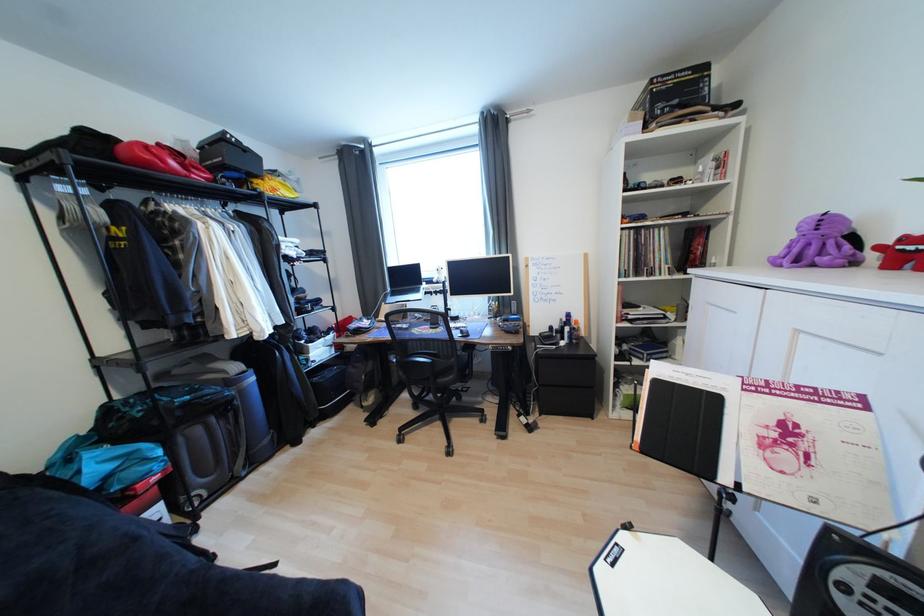
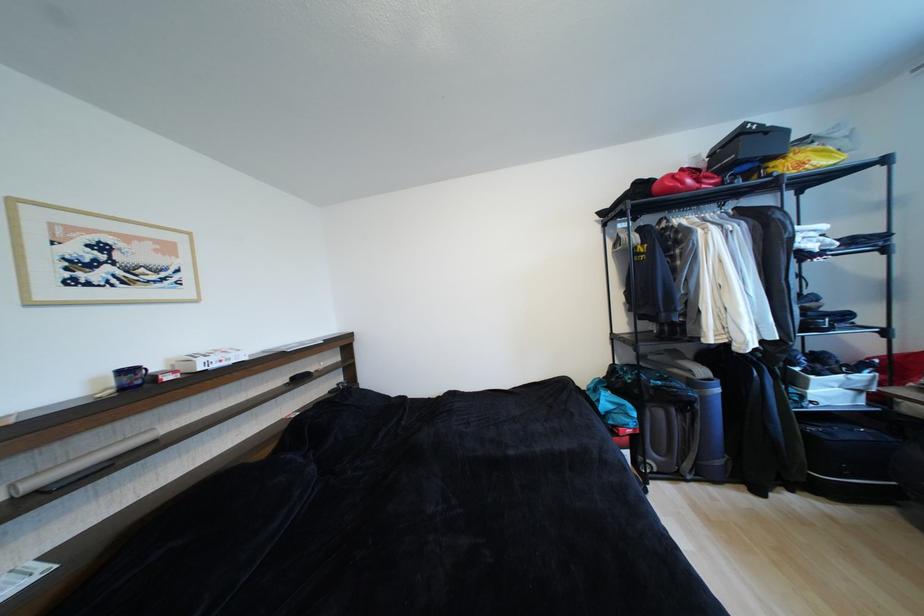
The point at (x=152, y=166) is marked in the first image. Where is the corresponding point in the second image?

(676, 192)